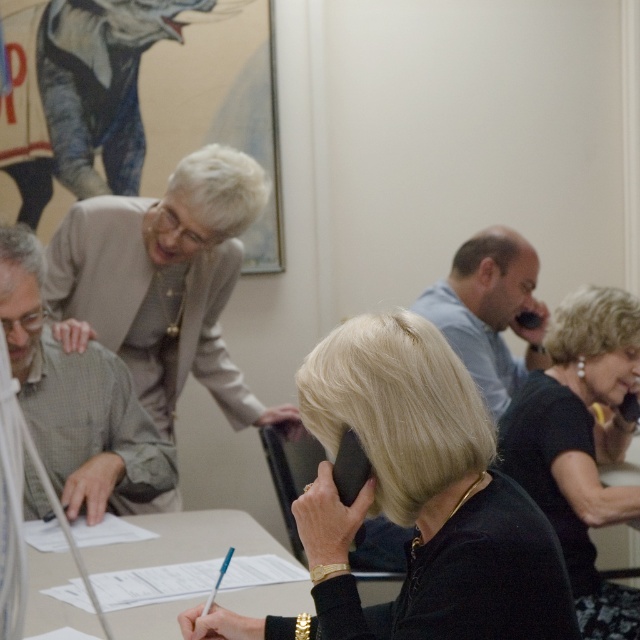
Question: Can you confirm if black matte phone at center is positioned to the left of light blue shirt at center?

Choices:
 (A) yes
 (B) no

Answer: (A)

Question: Which of these objects is positioned farthest from the green plaid shirt at left?

Choices:
 (A) gray fabric shirt at upper left
 (B) light blue shirt at center
 (C) black matte phone at center

Answer: (B)

Question: Which point is farther to the camera?

Choices:
 (A) (54, 259)
 (B) (424, 296)
 (C) (609, 323)

Answer: (B)

Question: Among these points, which one is farthest from the camera?

Choices:
 (A) (35, 593)
 (B) (472, 243)
 (C) (576, 580)
 (D) (45, 296)

Answer: (B)

Question: Does green plaid shirt at left have a greater width compared to white paper at center?

Choices:
 (A) yes
 (B) no

Answer: (B)

Question: Considering the relative positions of black matte phone at center and light blue shirt at center in the image provided, where is black matte phone at center located with respect to light blue shirt at center?

Choices:
 (A) right
 (B) left

Answer: (B)